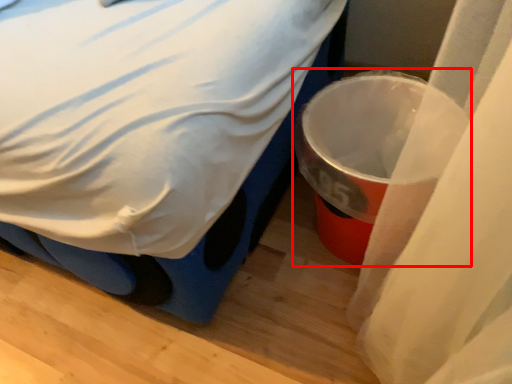
Question: From the image's perspective, what is the correct spatial relationship of waste container (annotated by the red box) in relation to bed?

Choices:
 (A) below
 (B) above

Answer: (A)